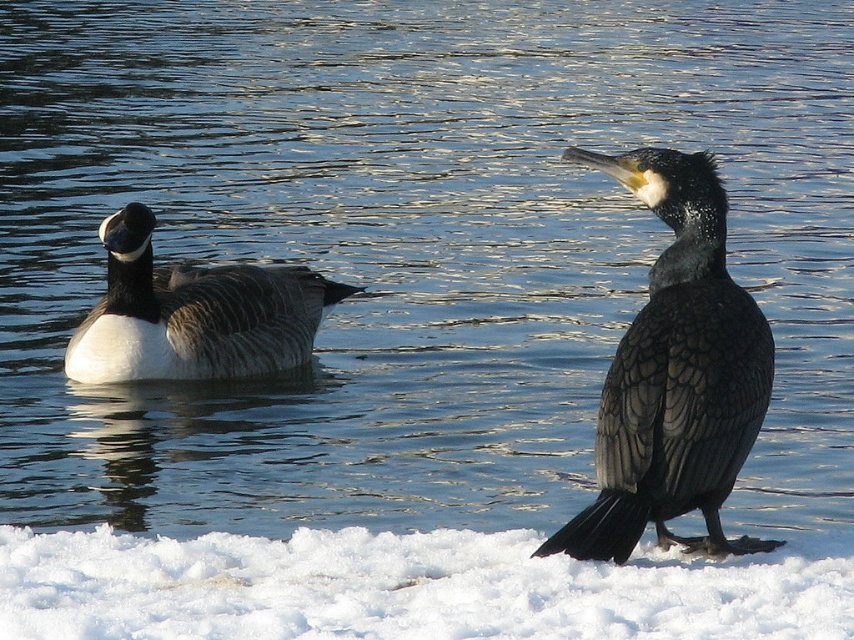
Consider the image. You are a photographer trying to capture both the white fluffy snow at lower center and the white matte duck at left in the same frame. Based on their positions, which object will appear closer to the camera in the photo?

The white fluffy snow at lower center appears closer to the camera because it is positioned in front of the white matte duck at left.

You are an animal photographer trying to capture both the white fluffy snow at lower center and the white matte duck at left in a single frame. Based on their sizes in the image, which object would you need to adjust your camera focus to capture more clearly?

The white fluffy snow at lower center occupies less space than the white matte duck at left, so you should adjust your focus to capture the white fluffy snow at lower center more clearly since it is smaller and might be harder to see.

You are a photographer trying to capture both the white fluffy snow at lower center and the white matte duck at left in the same frame. Based on their positions, which object should you adjust your camera to focus on first to ensure both are in the shot?

Since the white fluffy snow at lower center is to the right of the white matte duck at left, you should focus on the white matte duck at left first as it is on the left side, allowing you to frame both objects by adjusting the camera to include both the left and right positioned objects.